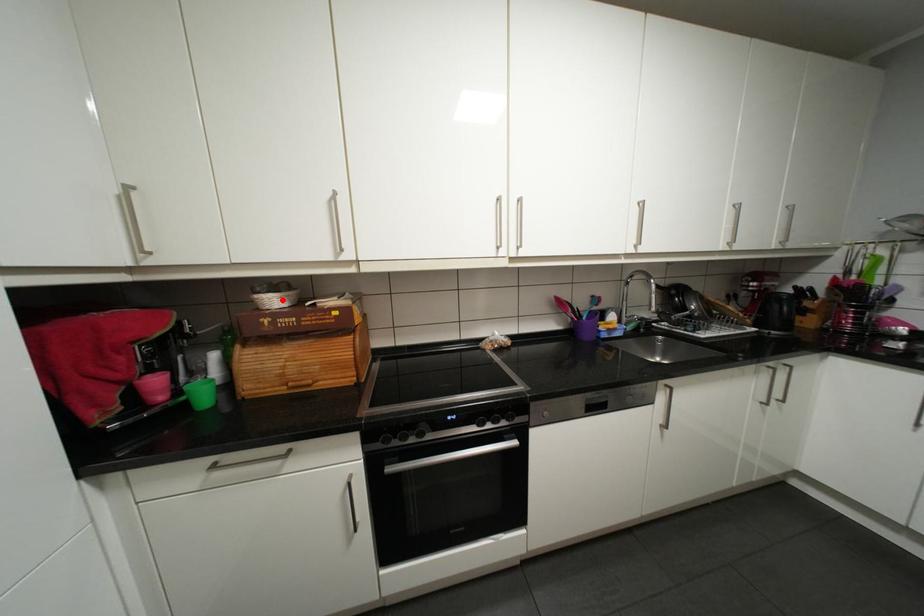
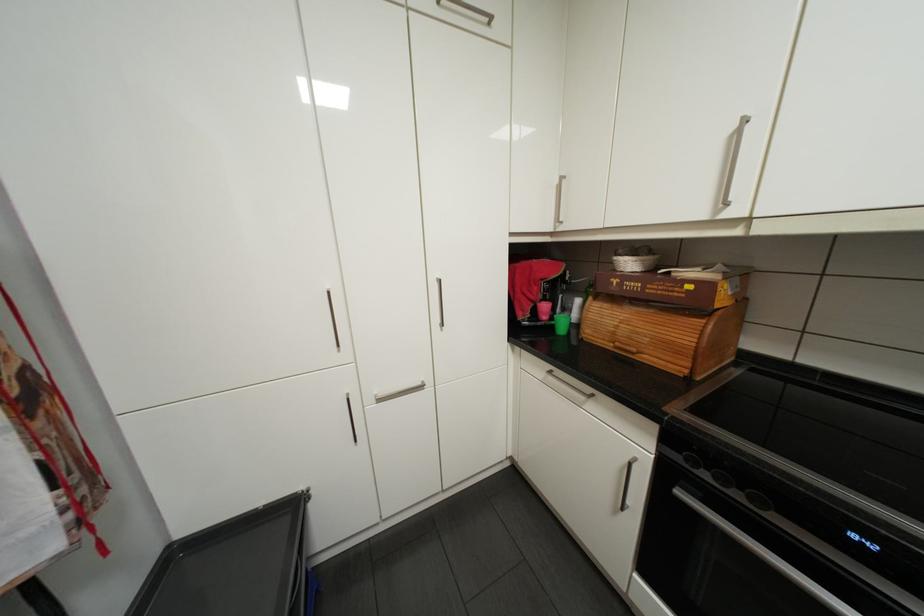
Question: I am providing you with two images of the same scene from different viewpoints. A red point is marked on the first image. Is the red point's position out of view in image 2?

Choices:
 (A) Yes
 (B) No

Answer: (B)